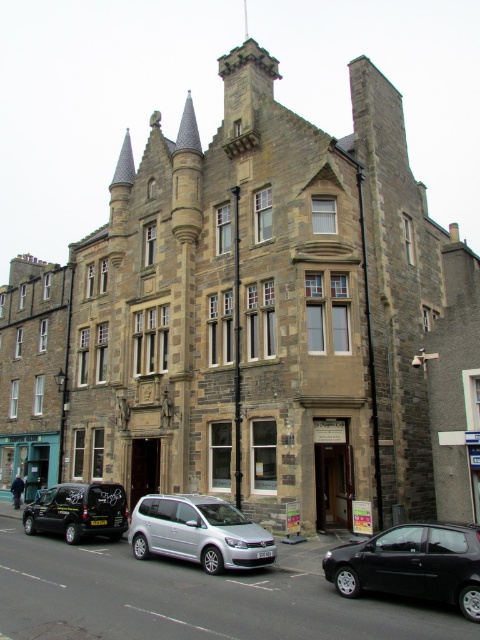
Is point (337, 589) closer to viewer compared to point (66, 508)?

Yes, it is in front of point (66, 508).

Consider the image. Does black matte hatchback at lower right appear over black matte van at lower left?

Yes.

This screenshot has width=480, height=640. In order to click on black matte hatchback at lower right in this screenshot , I will do `click(411, 564)`.

Is black matte hatchback at lower right smaller than silver metallic van at center?

Yes, black matte hatchback at lower right is smaller than silver metallic van at center.

Which of these two, black matte hatchback at lower right or silver metallic van at center, stands taller?

With more height is silver metallic van at center.

Locate an element on the screen. The width and height of the screenshot is (480, 640). black matte hatchback at lower right is located at coordinates (411, 564).

Can you confirm if silver metallic van at center is thinner than black matte van at lower left?

Yes, silver metallic van at center is thinner than black matte van at lower left.

Is silver metallic van at center further to the viewer compared to black matte van at lower left?

No, it is not.

Locate an element on the screen. This screenshot has width=480, height=640. silver metallic van at center is located at coordinates (199, 532).